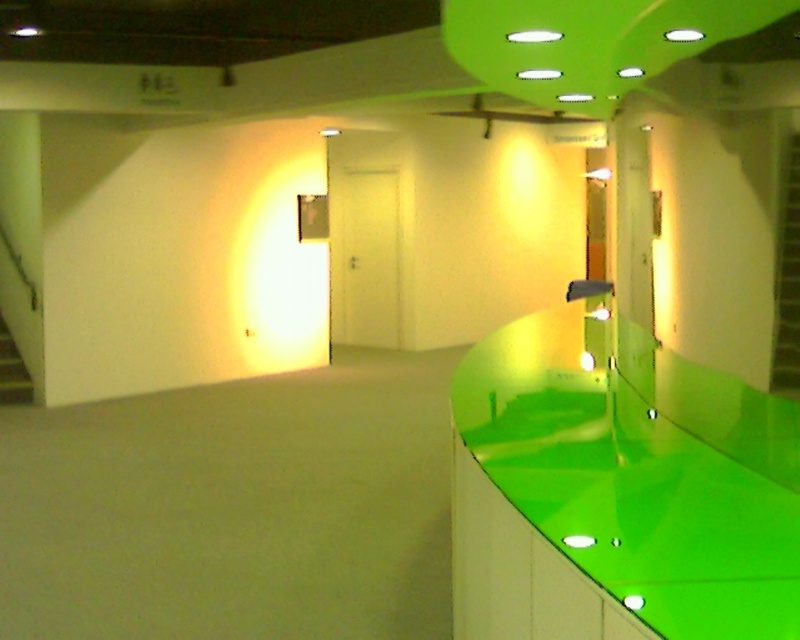
Question: Which is nearer to the wooden staircase at lower left?

Choices:
 (A) green glossy stairwell at right
 (B) glossy green countertop at right

Answer: (B)

Question: Which object appears farthest from the camera in this image?

Choices:
 (A) wooden staircase at lower left
 (B) glossy green countertop at right
 (C) green glossy stairwell at right

Answer: (A)

Question: Is glossy green countertop at right bigger than green glossy stairwell at right?

Choices:
 (A) no
 (B) yes

Answer: (B)

Question: Which point is farther to the camera?

Choices:
 (A) green glossy stairwell at right
 (B) glossy green countertop at right
 (C) wooden staircase at lower left

Answer: (C)

Question: Does green glossy stairwell at right have a greater width compared to wooden staircase at lower left?

Choices:
 (A) no
 (B) yes

Answer: (A)

Question: From the image, what is the correct spatial relationship of glossy green countertop at right in relation to wooden staircase at lower left?

Choices:
 (A) below
 (B) above

Answer: (B)